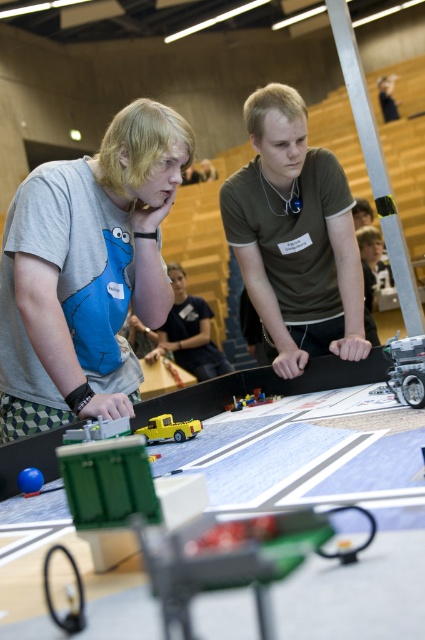
Looking at this image, you are a judge at the robotics competition and need to determine which of the two shirts at the center of the table is smaller. The shirts are labeled as matte gray shirt at center and matte black shirt at center. Which one is smaller?

The matte gray shirt at center is smaller than the matte black shirt at center according to the description provided.

You are a participant in the robotics competition and need to locate the person wearing the matte gray shirt at center. Based on the scene description, where would you find them?

The matte gray shirt at center is located at point (87, 272), so you can find them at that coordinate position.